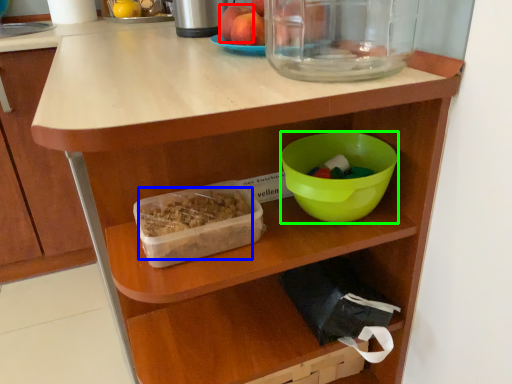
Question: Which is farther away from apple (highlighted by a red box)? food (highlighted by a blue box) or bowl (highlighted by a green box)?

Choices:
 (A) food
 (B) bowl

Answer: (A)